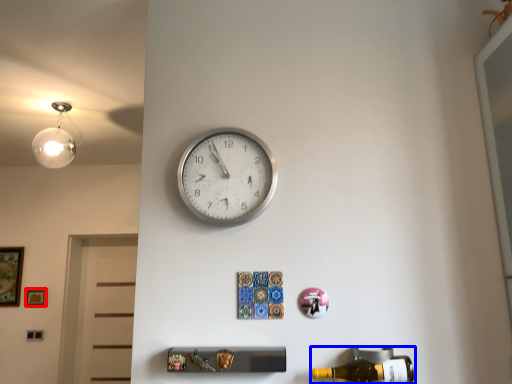
Question: Which point is closer to the camera, picture frame (highlighted by a red box) or beer bottle (highlighted by a blue box)?

Choices:
 (A) picture frame
 (B) beer bottle

Answer: (B)